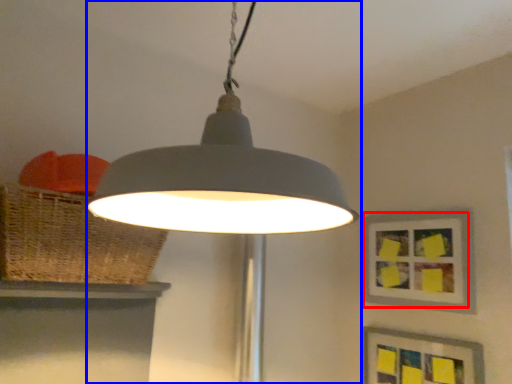
Question: Which of the following is the closest to the observer, picture frame (highlighted by a red box) or lamp (highlighted by a blue box)?

Choices:
 (A) picture frame
 (B) lamp

Answer: (B)